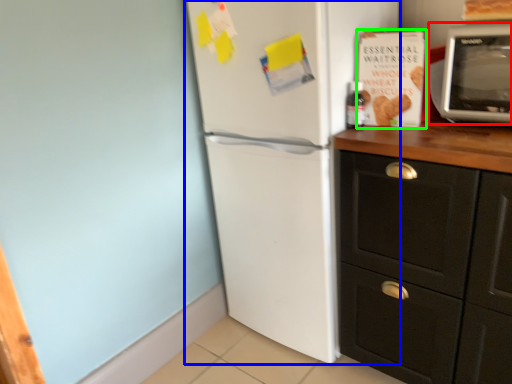
Question: Which is farther away from microwave oven (highlighted by a red box)? refrigerator (highlighted by a blue box) or magazine (highlighted by a green box)?

Choices:
 (A) refrigerator
 (B) magazine

Answer: (A)